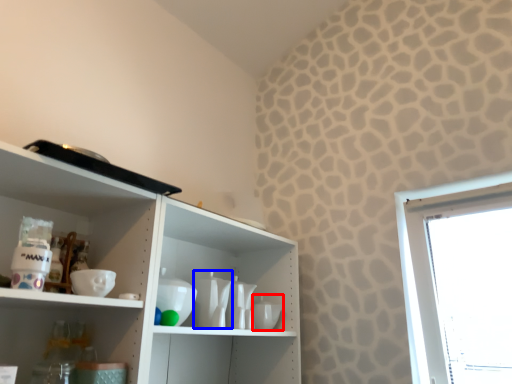
Question: Among these objects, which one is farthest to the camera, tableware (highlighted by a red box) or tableware (highlighted by a blue box)?

Choices:
 (A) tableware
 (B) tableware

Answer: (A)